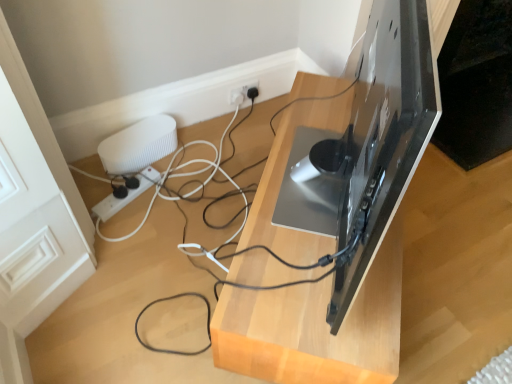
Locate an element on the screen. The image size is (512, 384). free space in front of white plastic power strip at lower left is located at coordinates (129, 236).